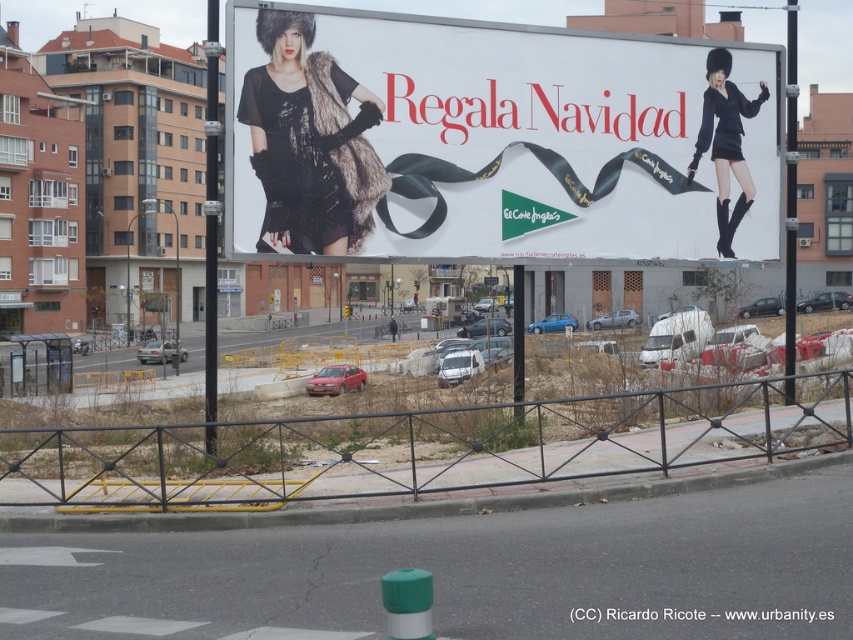
Question: Which is farther from the matte black fur coat at right?

Choices:
 (A) matte black dress at center
 (B) fur coat at upper center

Answer: (A)

Question: Can you confirm if matte black dress at center is thinner than fur coat at upper center?

Choices:
 (A) yes
 (B) no

Answer: (A)

Question: Is fur coat at upper center closer to the viewer compared to matte black fur coat at right?

Choices:
 (A) no
 (B) yes

Answer: (B)

Question: Where is black metal fence at lower center located in relation to fur coat at upper center in the image?

Choices:
 (A) left
 (B) right

Answer: (B)

Question: Considering the real-world distances, which object is farthest from the matte black fur coat at right?

Choices:
 (A) matte black dress at center
 (B) black metal fence at lower center

Answer: (A)

Question: Which is farther from the black metal fence at lower center?

Choices:
 (A) matte black dress at center
 (B) matte black fur coat at right

Answer: (A)